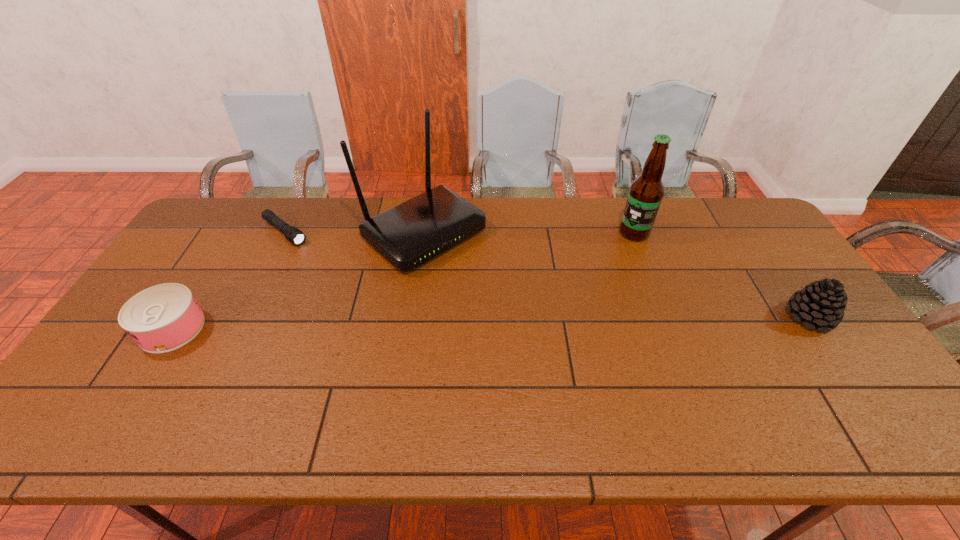
This screenshot has height=540, width=960. I want to click on vacant area that lies between the fourth object from right to left and the third object from left to right, so click(x=354, y=233).

Identify the location of free space between the flashlight and the can. (228, 280).

I want to click on vacant area that lies between the second shortest object and the second object from left to right, so click(x=228, y=280).

Where is `free space between the third object from right to left and the second object from left to right`? free space between the third object from right to left and the second object from left to right is located at coordinates [354, 233].

At what (x,y) coordinates should I click in order to perform the action: click on vacant area between the second object from left to right and the pinecone. Please return your answer as a coordinate pair (x, y). Image resolution: width=960 pixels, height=540 pixels. Looking at the image, I should click on pyautogui.click(x=547, y=275).

Where is `free space between the fourth object from left to right and the can`? free space between the fourth object from left to right and the can is located at coordinates (403, 281).

At what (x,y) coordinates should I click in order to perform the action: click on vacant region between the third shortest object and the shortest object. Please return your answer as a coordinate pair (x, y). The image size is (960, 540). Looking at the image, I should click on (547, 275).

Find the location of a particular element. This screenshot has width=960, height=540. object that is the second closest to the second object from right to left is located at coordinates (408, 235).

Locate an element on the screen. The height and width of the screenshot is (540, 960). the second closest object to the third object from left to right is located at coordinates (164, 317).